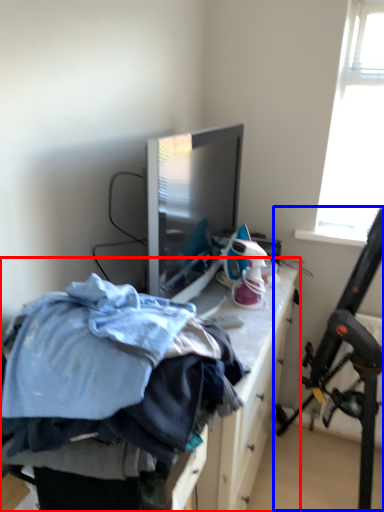
Question: Which object appears closest to the camera in this image, furniture (highlighted by a red box) or folding chair (highlighted by a blue box)?

Choices:
 (A) furniture
 (B) folding chair

Answer: (A)